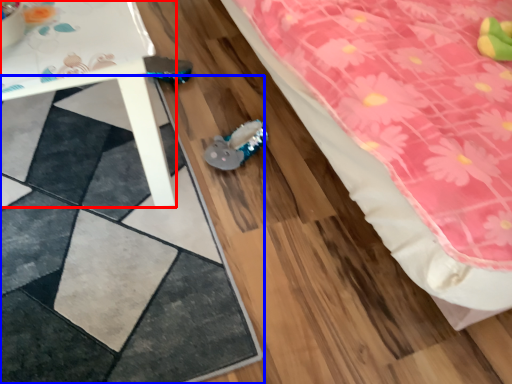
Question: Which object appears closest to the camera in this image, table (highlighted by a red box) or square (highlighted by a blue box)?

Choices:
 (A) table
 (B) square

Answer: (A)